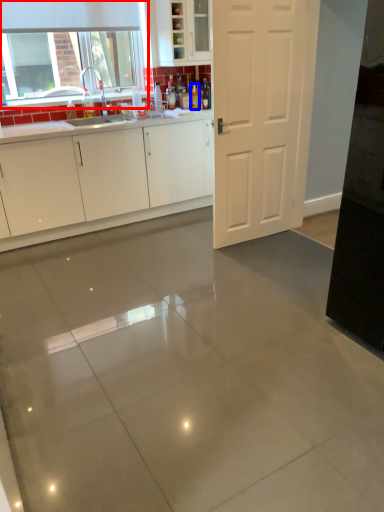
Question: Which of the following is the farthest to the observer, window (highlighted by a red box) or bottle (highlighted by a blue box)?

Choices:
 (A) window
 (B) bottle

Answer: (B)